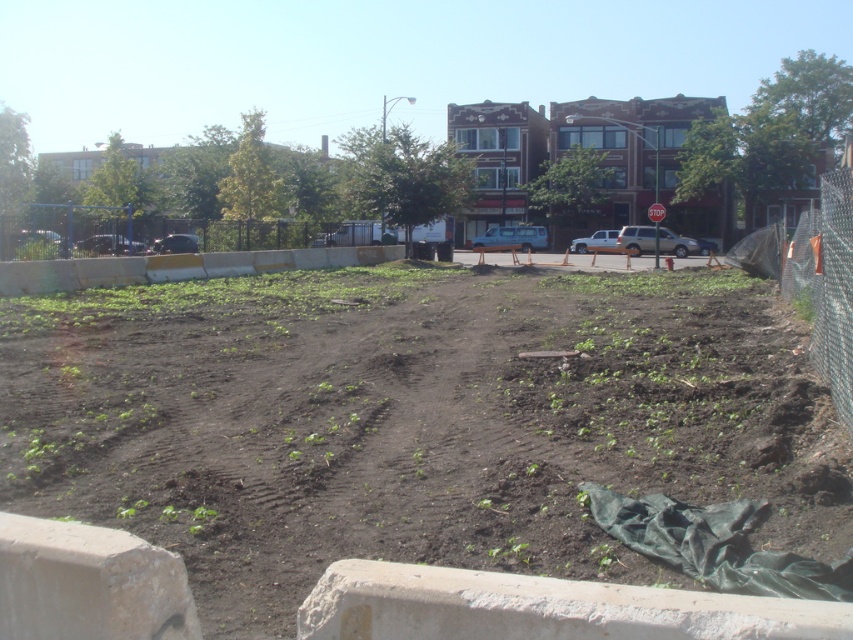
Can you confirm if dark brown soil at center is thinner than black metal fence at left?

Incorrect, dark brown soil at center's width is not less than black metal fence at left's.

Does dark brown soil at center have a lesser height compared to black metal fence at left?

Correct, dark brown soil at center is not as tall as black metal fence at left.

Does point (492, 518) come in front of point (271, 236)?

That is True.

The height and width of the screenshot is (640, 853). I want to click on dark brown soil at center, so click(x=412, y=420).

Is dark brown soil at center above chain-link fence at right?

Actually, dark brown soil at center is below chain-link fence at right.

Consider the image. Between dark brown soil at center and chain-link fence at right, which one has more height?

With more height is chain-link fence at right.

The height and width of the screenshot is (640, 853). What do you see at coordinates (412, 420) in the screenshot? I see `dark brown soil at center` at bounding box center [412, 420].

At what (x,y) coordinates should I click in order to perform the action: click on dark brown soil at center. Please return your answer as a coordinate pair (x, y). The image size is (853, 640). Looking at the image, I should click on (412, 420).

Between black metal fence at left and chain-link fence at right, which one is positioned higher?

black metal fence at left is above.

Can you confirm if black metal fence at left is bigger than chain-link fence at right?

Yes, black metal fence at left is bigger than chain-link fence at right.

Is point (71, 212) in front of point (811, 241)?

That is False.

Identify the location of black metal fence at left. The width and height of the screenshot is (853, 640). (148, 234).